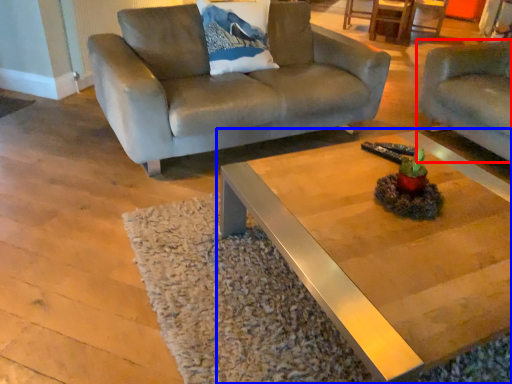
Question: Among these objects, which one is nearest to the camera, studio couch (highlighted by a red box) or coffee table (highlighted by a blue box)?

Choices:
 (A) studio couch
 (B) coffee table

Answer: (B)